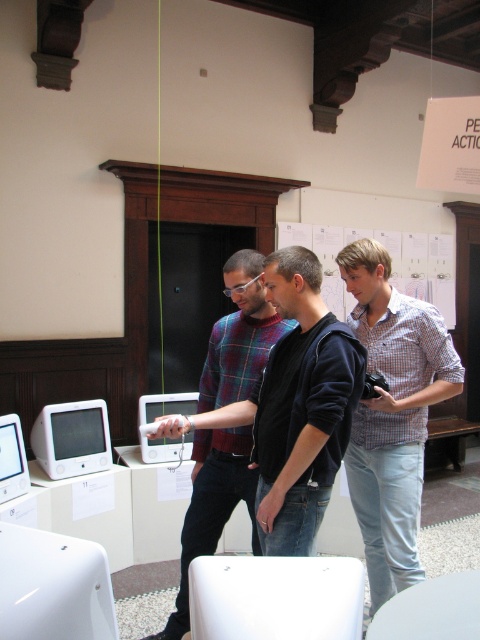
You are standing in the gallery and want to take a photo of the point at coordinates (393,406). The camera you are using has a focal length of 50mm and a sensor size of 24mm. What is the minimum distance you need to move forward to ensure the point fills the frame vertically?

The point at coordinates (393,406) is 2.29 meters away from the camera. To calculate the minimum distance needed, use the formula distance_sensor_to_subject divided by sensor_size multiplied by focal_length. Plugging in the values, 2.29 meters divided by 0.024 meters equals approximately 95.42. Multiply that by 0.05 meters for the focal length, resulting in approximately 4.77 meters. Therefore, you need to move to 4.77 meters from the point to fill the frame vertically.

You are a photographer trying to capture a clear image of the white glossy monitor at left. The light blue jeans at center are blocking the view. Can you estimate whether the jeans are wider than the monitor to determine if moving them would help?

The light blue jeans at center might be wider than white glossy monitor at left, so moving them could improve the view of the white glossy monitor at left.

You are an interior designer assessing the layout of this room. You need to determine if the white plastic monitor at lower left can be placed on a shelf that can only accommodate items up to the size of the white glossy computer at center. Can it fit?

The white plastic monitor at lower left has a larger width than the white glossy computer at center, so it cannot fit on the shelf designed for items up to the size of the white glossy computer at center.